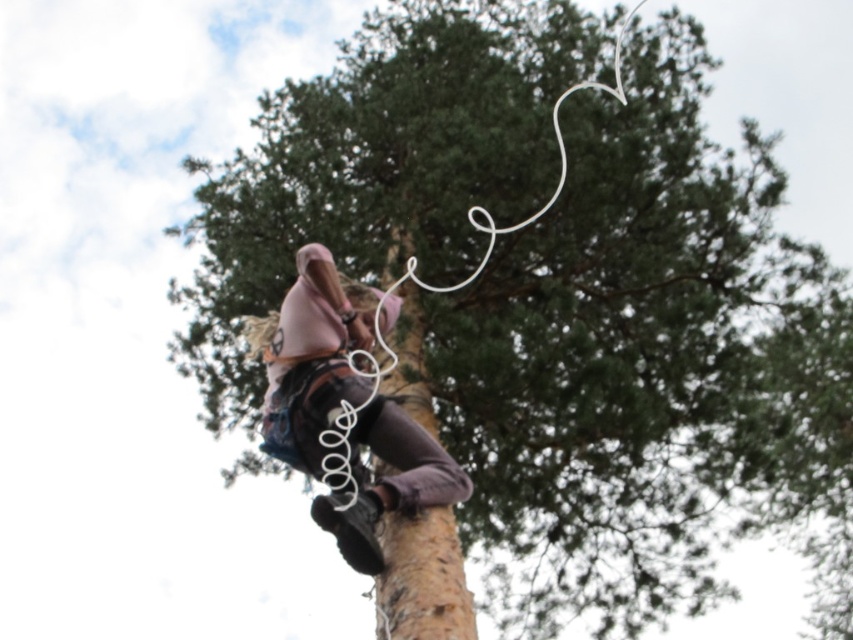
Question: Can you confirm if pink fabric at center is smaller than brown rough tree trunk at center?

Choices:
 (A) no
 (B) yes

Answer: (A)

Question: Which point is farther from the camera taking this photo?

Choices:
 (A) (390, 566)
 (B) (415, 422)

Answer: (B)

Question: Is pink fabric at center in front of brown rough tree trunk at center?

Choices:
 (A) no
 (B) yes

Answer: (A)

Question: Observing the image, what is the correct spatial positioning of pink fabric at center in reference to brown rough tree trunk at center?

Choices:
 (A) above
 (B) below

Answer: (A)

Question: Which of the following is the farthest from the observer?

Choices:
 (A) brown rough tree trunk at center
 (B) pink fabric at center

Answer: (B)

Question: Which point is farther to the camera?

Choices:
 (A) pink fabric at center
 (B) brown rough tree trunk at center

Answer: (A)